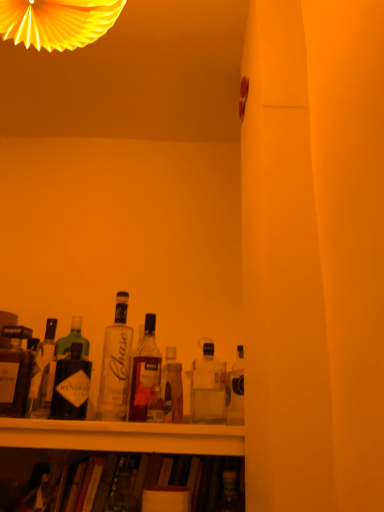
Question: Is translucent glass bottle at center, marked as the 4th bottle in a left-to-right arrangement, situated inside matte black bottle at left, the 1th bottle viewed from the left, or outside?

Choices:
 (A) outside
 (B) inside

Answer: (A)

Question: Considering the relative positions of translucent glass bottle at center, marked as the 4th bottle in a left-to-right arrangement, and matte black bottle at left, the 1th bottle viewed from the left, in the image provided, is translucent glass bottle at center, marked as the 4th bottle in a left-to-right arrangement, to the left or to the right of matte black bottle at left, the 1th bottle viewed from the left,?

Choices:
 (A) right
 (B) left

Answer: (A)

Question: Estimate the real-world distances between objects in this image. Which object is farther from the matte glass bottle at left, the 2th bottle from the left?

Choices:
 (A) translucent glass bottle at center, arranged as the 2th bottle when viewed from the right
 (B) clear glass bottle at center, which is the 3th bottle from left to right
 (C) matte black bottle at left, marked as the 6th bottle in a right-to-left arrangement
 (D) translucent glass bottle at center, marked as the 4th bottle in a left-to-right arrangement
 (E) clear glass bottle at center, which is the sixth bottle in left-to-right order

Answer: (E)

Question: Which is farther from the clear glass bottle at center, which is the sixth bottle in left-to-right order?

Choices:
 (A) translucent glass bottle at center, positioned as the 5th bottle in left-to-right order
 (B) matte glass bottle at left, the 2th bottle from the left
 (C) matte black bottle at left, marked as the 6th bottle in a right-to-left arrangement
 (D) clear glass bottle at center, the fourth bottle in the right-to-left sequence
 (E) translucent glass bottle at center, acting as the third bottle starting from the right

Answer: (C)